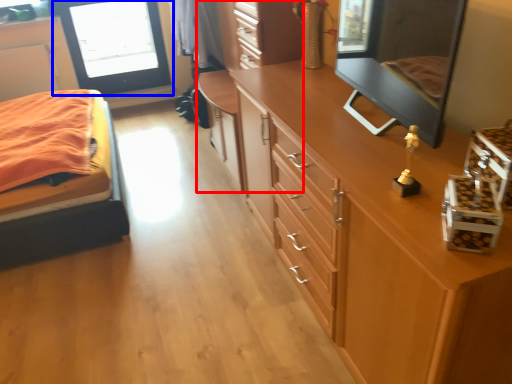
Question: Which object appears farthest to the camera in this image, dresser (highlighted by a red box) or window screen (highlighted by a blue box)?

Choices:
 (A) dresser
 (B) window screen

Answer: (B)